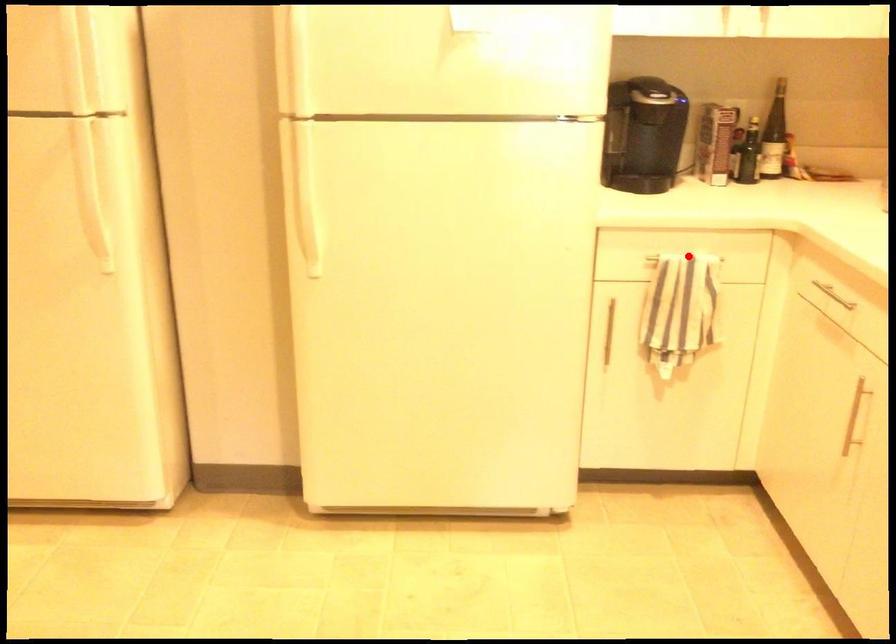
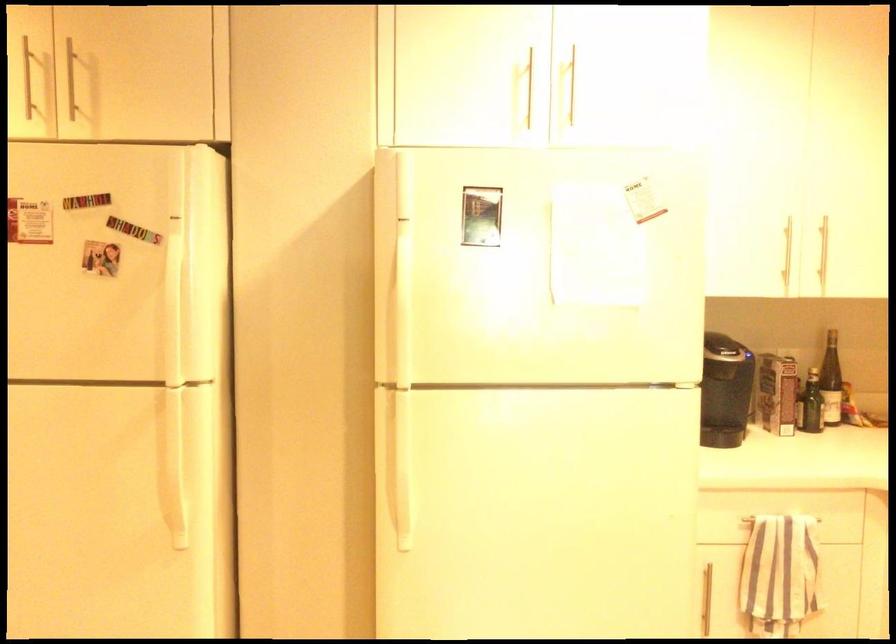
The point at the highlighted location is marked in the first image. Where is the corresponding point in the second image?

(781, 518)